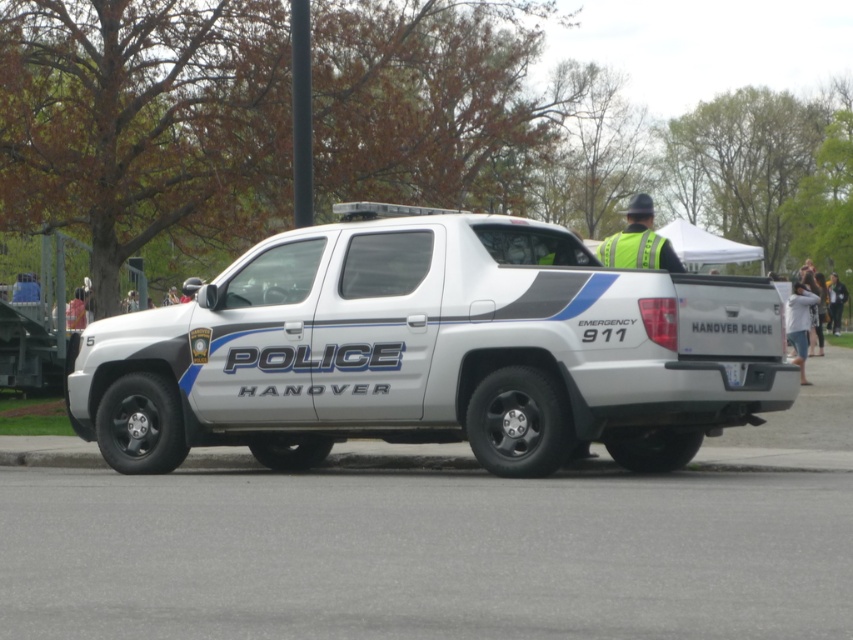
You are a pedestrian standing in front of the Hanover Police Department vehicle. You notice two items on the vehicle. Which item is positioned to the left when viewed from the front? The two items are the yellow reflective vest at upper right and the white plastic license plate at rear.

The yellow reflective vest at upper right is positioned to the left of the white plastic license plate at rear when viewed from the front.

You are a pedestrian standing at the edge of the parking lot. You see a white glossy police car at center and a yellow reflective vest at upper right. Which object is larger in size?

The white glossy police car at center is bigger than the yellow reflective vest at upper right.

You are a delivery person trying to load a package onto the white glossy police car at center. The package is 2 meters tall. Can you safely load it without hitting the white plastic license plate at rear?

The white glossy police car at center is much taller as white plastic license plate at rear, so the package can be safely loaded without hitting the license plate.